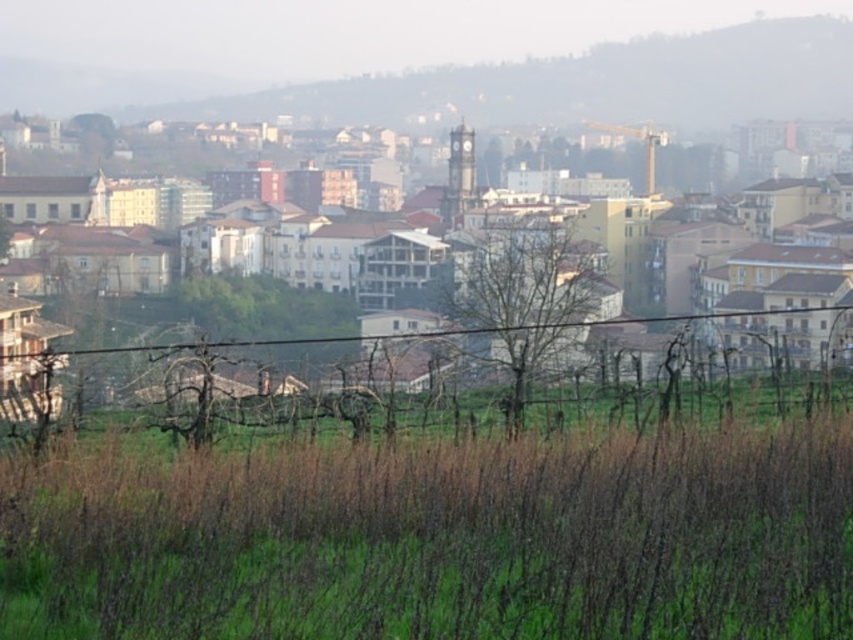
You are a drone operator tasked with capturing aerial footage of the town. You notice the green grass at lower center and the brown textured buildings at center. Which area would require a closer flyby to capture clear details, and why?

The green grass at lower center requires a closer flyby because it is thinner than the brown textured buildings at center, making it harder to capture clear details from a distance.

You are standing at the town square and want to reach the brown textured buildings at center. According to the map, your current position is at point 0.0, 0.0. What direction should you head to reach them?

The brown textured buildings at center are located at point (729, 264), so you should head northeast to reach them.

You are standing in the field of green grass at lower center and want to reach the brown textured buildings at center. Which direction should you move to get there?

You should move upward from the green grass at lower center to reach the brown textured buildings at center since the grass is positioned under the buildings.